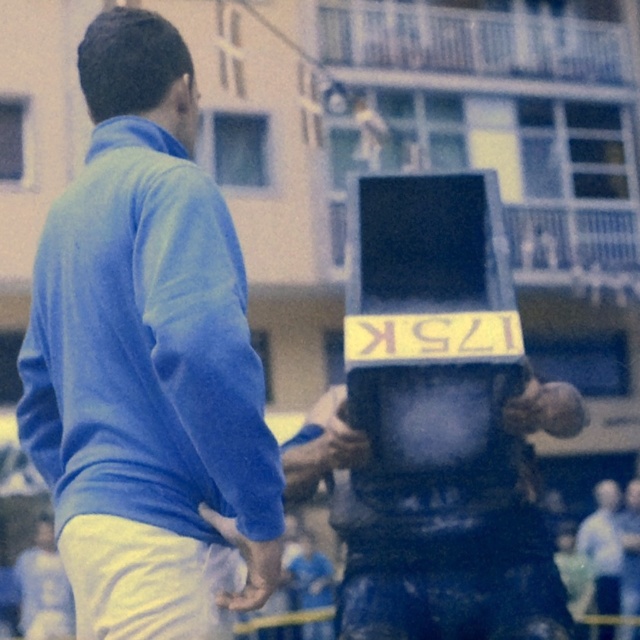
Is point (56, 561) positioned behind point (627, 513)?

That is False.

Is light blue fabric pants at lower left wider than matte black helmet at center?

Correct, the width of light blue fabric pants at lower left exceeds that of matte black helmet at center.

What do you see at coordinates (44, 588) in the screenshot? I see `light blue fabric pants at lower left` at bounding box center [44, 588].

Identify the location of light blue fabric pants at lower left. This screenshot has height=640, width=640. (44, 588).

Does point (132, 461) come closer to viewer compared to point (632, 580)?

Yes.

Is blue matte sweater at upper left shorter than matte black helmet at center?

No, blue matte sweater at upper left is not shorter than matte black helmet at center.

Does point (136, 500) come closer to viewer compared to point (627, 536)?

That is True.

This screenshot has height=640, width=640. I want to click on blue matte sweater at upper left, so click(x=147, y=362).

Is blue matte sweater at upper left taller than light blue shirt at right?

Yes, blue matte sweater at upper left is taller than light blue shirt at right.

Image resolution: width=640 pixels, height=640 pixels. What do you see at coordinates (147, 362) in the screenshot? I see `blue matte sweater at upper left` at bounding box center [147, 362].

The height and width of the screenshot is (640, 640). Find the location of `blue matte sweater at upper left`. blue matte sweater at upper left is located at coordinates (147, 362).